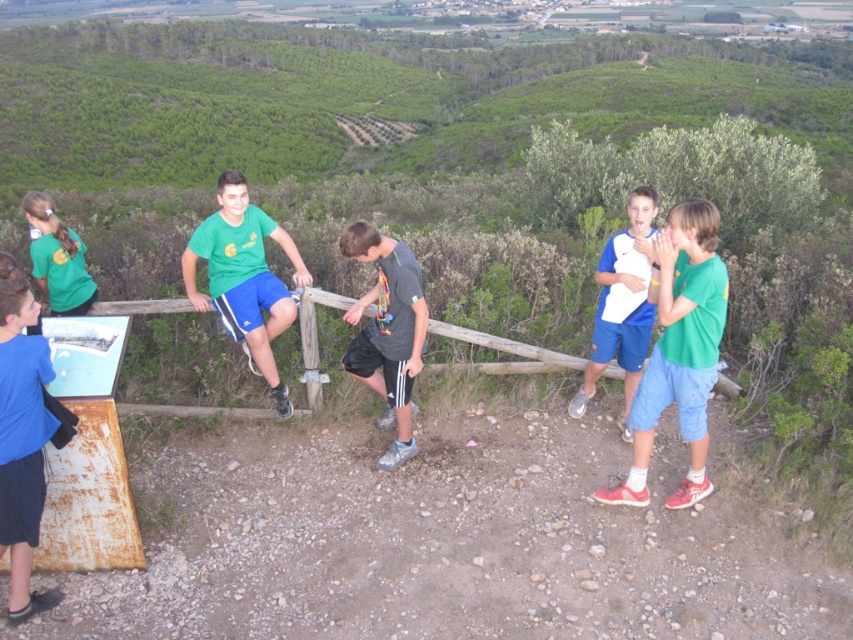
Based on the photo, you are trying to decide which clothing item has a larger horizontal width in the image. The options are the dark gray fabric shorts at center and the blue fabric shirt at right. Based on the scene description, which one is wider?

The dark gray fabric shorts at center might be wider than blue fabric shirt at right according to the description.